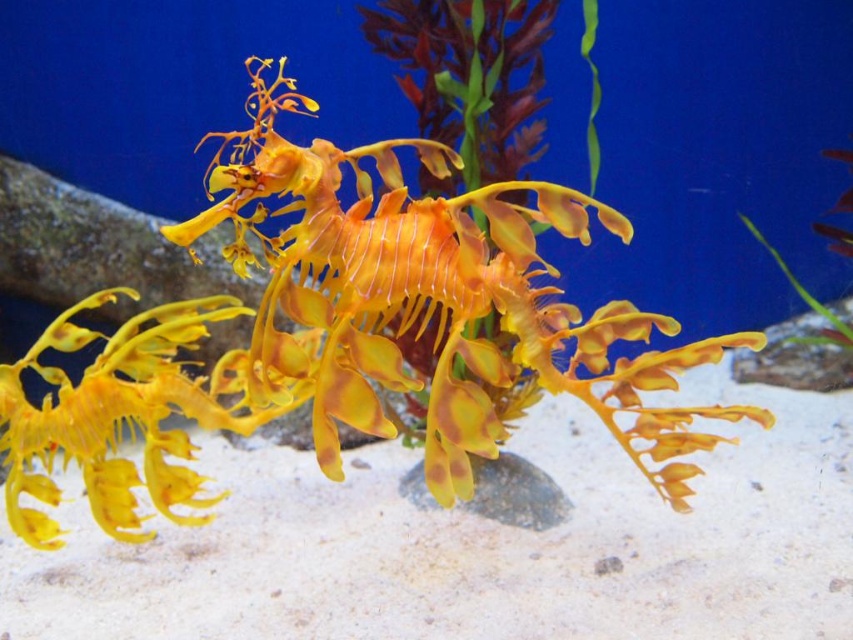
Question: Which point is farther to the camera?

Choices:
 (A) yellow matte seahorse at center
 (B) green leafy plant at center

Answer: (B)

Question: Does yellow matte seahorse at center have a lesser width compared to green leafy plant at center?

Choices:
 (A) no
 (B) yes

Answer: (A)

Question: Which object is closer to the camera taking this photo?

Choices:
 (A) yellow matte seahorse at center
 (B) green leafy plant at center

Answer: (A)

Question: Is yellow matte seahorse at center to the right of green leafy plant at center from the viewer's perspective?

Choices:
 (A) yes
 (B) no

Answer: (B)

Question: Which point is closer to the camera?

Choices:
 (A) yellow matte seahorse at center
 (B) green leafy plant at center

Answer: (A)

Question: Observing the image, what is the correct spatial positioning of yellow matte seahorse at center in reference to green leafy plant at center?

Choices:
 (A) right
 (B) left

Answer: (B)